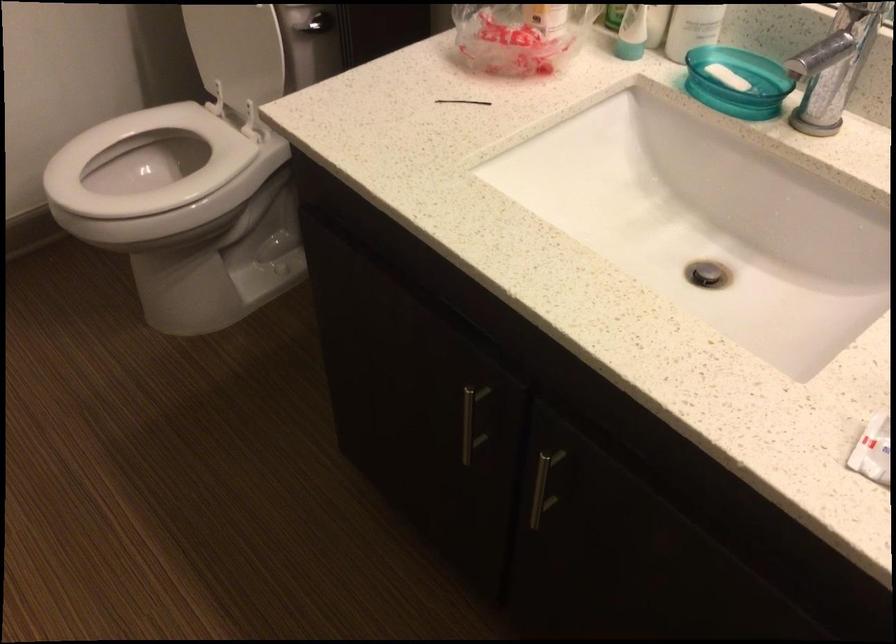
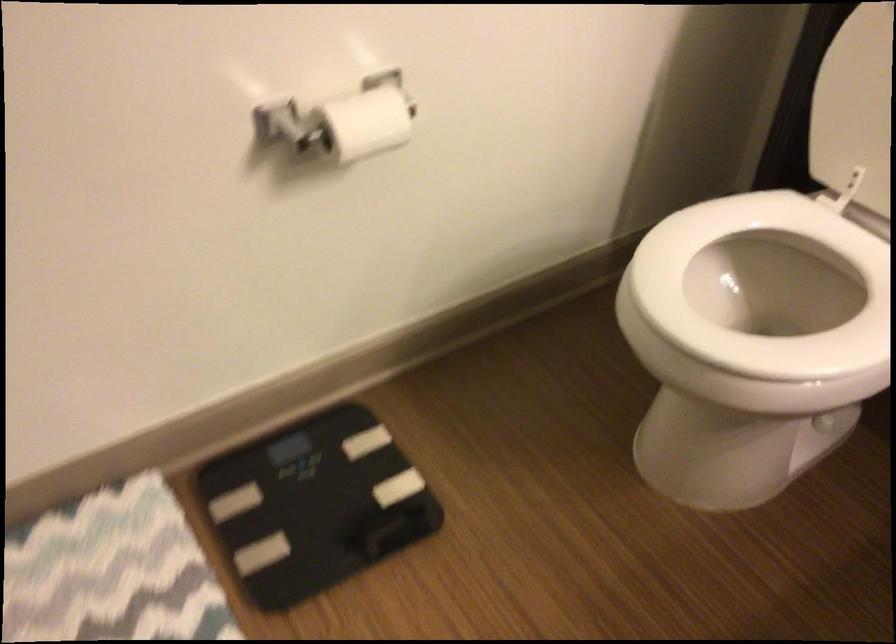
In the scene shown: Which direction would the cameraman need to move to produce the second image?

The movement direction of the cameraman is left, forward.